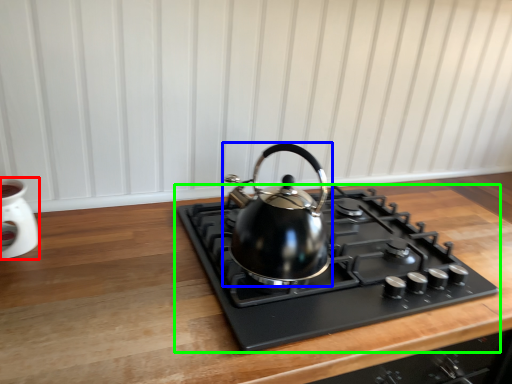
Question: Which object is positioned closest to appliance (highlighted by a red box)? Select from kettle (highlighted by a blue box) and gas stove (highlighted by a green box).

Choices:
 (A) kettle
 (B) gas stove

Answer: (A)